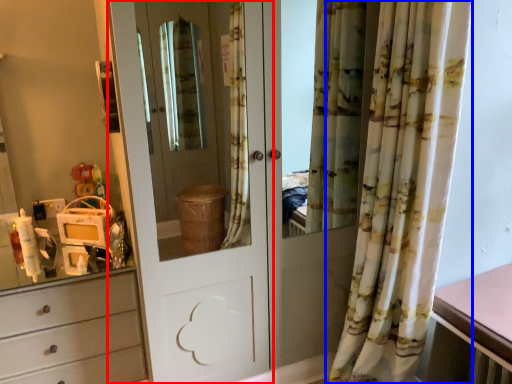
Question: Which of the following is the farthest to the observer, door (highlighted by a red box) or curtain (highlighted by a blue box)?

Choices:
 (A) door
 (B) curtain

Answer: (A)